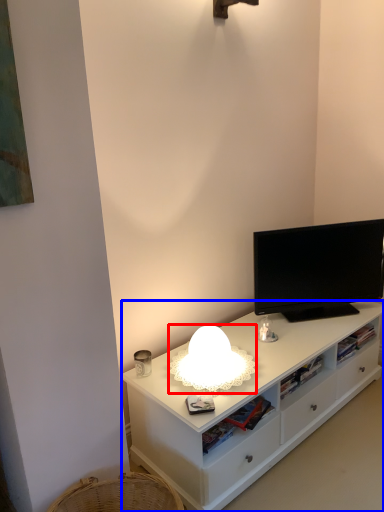
Question: Which point is further to the camera, lamp (highlighted by a red box) or cabinetry (highlighted by a blue box)?

Choices:
 (A) lamp
 (B) cabinetry

Answer: (A)